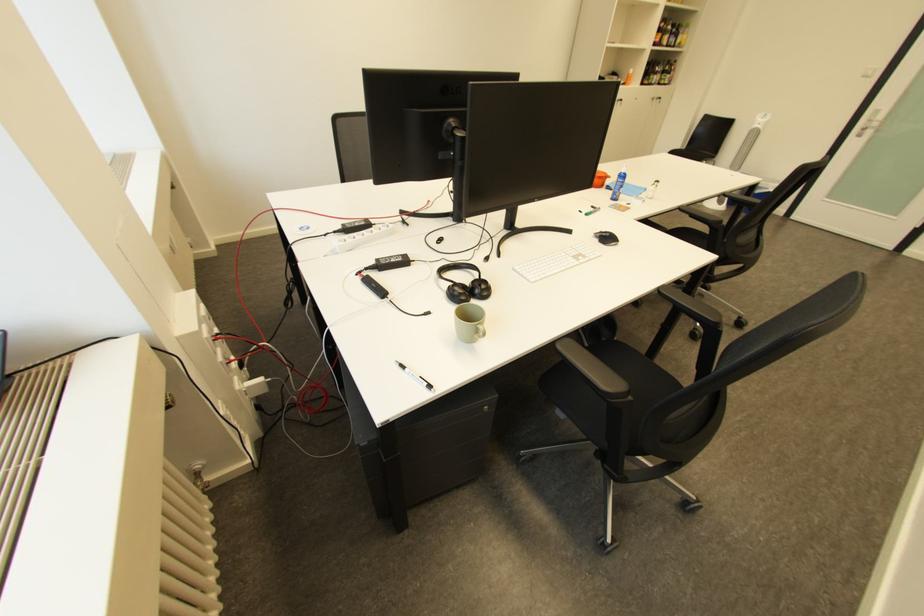
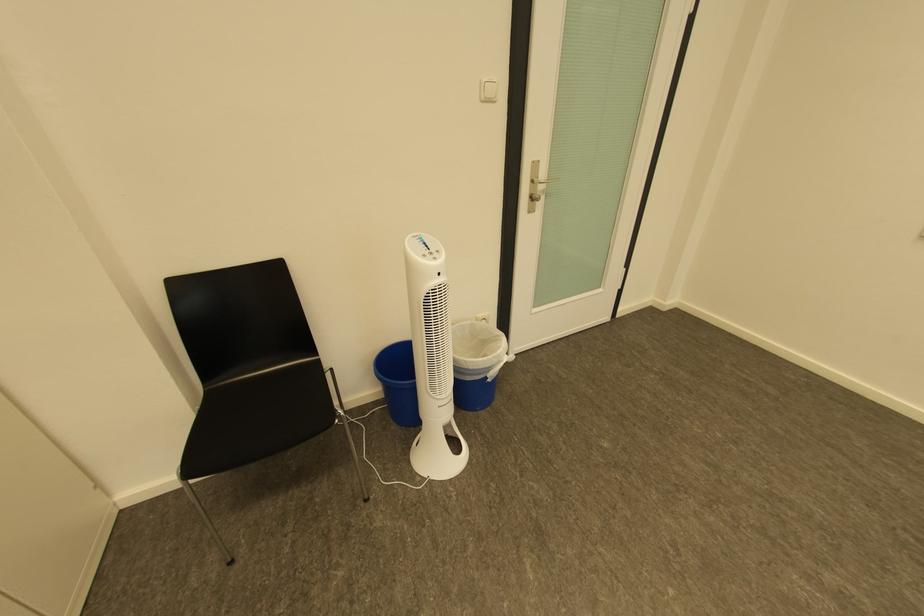
The point at (x=880, y=121) is marked in the first image. Where is the corresponding point in the second image?

(541, 182)